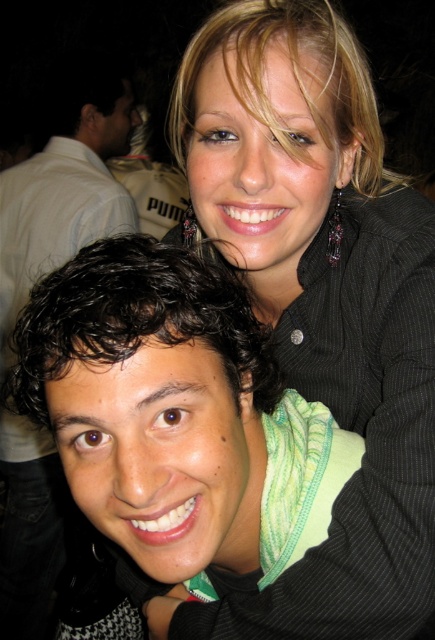
You are a photographer trying to adjust the focus of your camera. You want to ensure that both the black pinstripe jacket at upper right and the dark curly hair at left are clearly visible. Based on their positions, which one should you focus on first to ensure both are in focus?

You should focus on the dark curly hair at left first because the black pinstripe jacket at upper right is in front of it, so focusing on the background subject first may cause the foreground to be out of focus. By focusing on the closer subject, you can ensure both are in focus if they are within the depth of field.

You are a photographer trying to adjust the focus of your camera. You want to ensure that both the black pinstripe jacket at upper right and the dark curly hair at left are in focus. Given their sizes, which object should you focus on first to achieve proper depth of field?

The black pinstripe jacket at upper right has a smaller size compared to dark curly hair at left. To achieve proper depth of field, you should focus on the smaller object first, so focus on the black pinstripe jacket at upper right first.

You are a photographer trying to capture a clear shot of the two people in the scene. The person in the foreground is wearing a light green shirt with a patterned design, and the one behind is in a black pinstripe jacket at upper right. How much distance should you maintain between them to ensure both are in focus?

The two people should be kept 23.12 inches apart to ensure both are in focus.